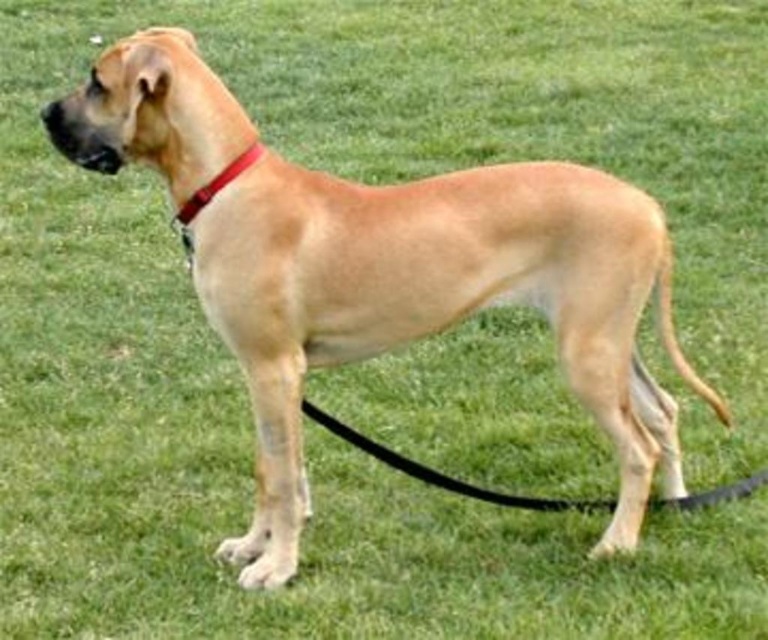
You are a dog owner trying to secure your dog properly. You see the black rubber leash at lower center and the red leather collar at upper left. Which item is positioned lower in the image?

The black rubber leash at lower center is positioned below the red leather collar at upper left, so the black rubber leash at lower center is lower in the image.

You are a dog owner trying to find your dog in the park. You see the point at coordinates (442, 474) in the image. Is the black rubber leash at lower center attached to the dog?

The black rubber leash at lower center is located at point (442, 474), so yes, the leash is attached to the dog at that point.

You are a dog owner trying to secure your dog properly. You notice the red leather collar at upper left and the black rubber leash at lower center. Which item is closer to the front of the dog?

The black rubber leash at lower center is closer to the front of the dog because the red leather collar at upper left is behind it.